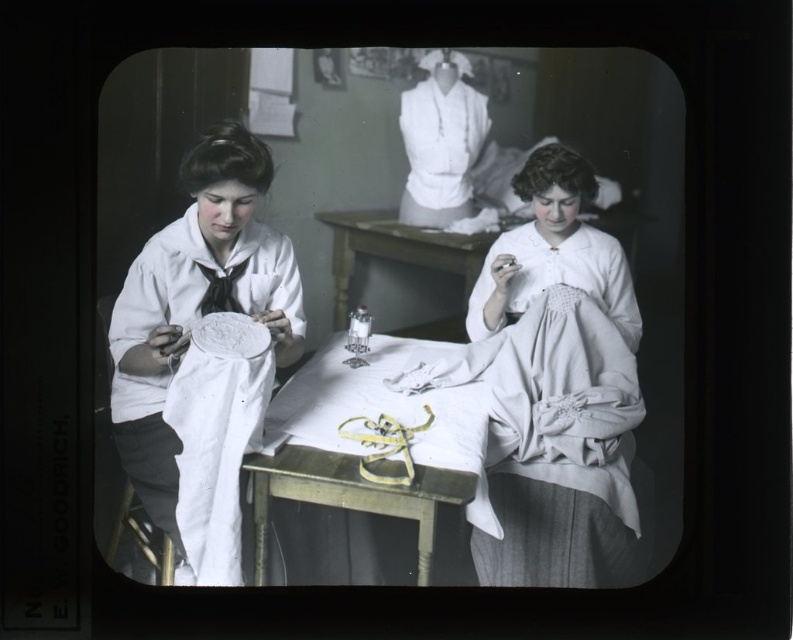
Between matte white fabric at center and wooden table at center, which one has more height?

matte white fabric at center is taller.

Can you confirm if matte white fabric at center is positioned below wooden table at center?

Actually, matte white fabric at center is above wooden table at center.

Describe the element at coordinates (557, 289) in the screenshot. I see `matte white fabric at center` at that location.

Where is `matte white fabric at center`? matte white fabric at center is located at coordinates (557, 289).

How much distance is there between matte white fabric at center and white cotton blouse at upper center?

A distance of 10.17 inches exists between matte white fabric at center and white cotton blouse at upper center.

The height and width of the screenshot is (640, 793). I want to click on matte white fabric at center, so click(557, 289).

I want to click on matte white fabric at center, so pyautogui.click(x=557, y=289).

Does wooden table at center appear on the left side of white cotton blouse at upper center?

Yes, wooden table at center is to the left of white cotton blouse at upper center.

Is wooden table at center further to camera compared to white cotton blouse at upper center?

No.

Locate an element on the screen. wooden table at center is located at coordinates (366, 481).

This screenshot has height=640, width=793. In order to click on wooden table at center in this screenshot , I will do `click(366, 481)`.